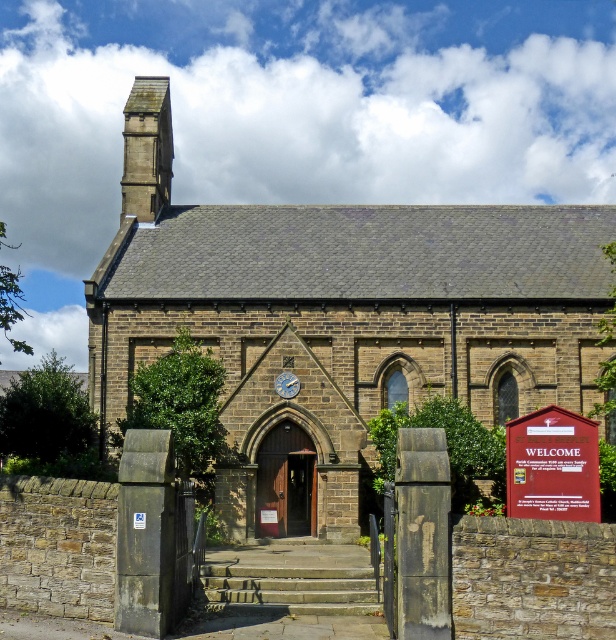
Question: Does stone spire at upper left appear under brown wooden door at center?

Choices:
 (A) no
 (B) yes

Answer: (A)

Question: Based on their relative distances, which object is nearer to the brown wooden door at center?

Choices:
 (A) concrete textured stairs at center
 (B) brown stone chapel at center
 (C) stone spire at upper left

Answer: (A)

Question: Among these objects, which one is farthest from the camera?

Choices:
 (A) brown wooden door at center
 (B) concrete textured stairs at center

Answer: (A)

Question: Is wooden welcome sign at lower right thinner than stone spire at upper left?

Choices:
 (A) yes
 (B) no

Answer: (A)

Question: Is brown stone chapel at center above brown wooden door at center?

Choices:
 (A) no
 (B) yes

Answer: (B)

Question: Which object is closer to the camera taking this photo?

Choices:
 (A) brown wooden door at center
 (B) stone spire at upper left
 (C) brown stone chapel at center
 (D) concrete textured stairs at center

Answer: (D)